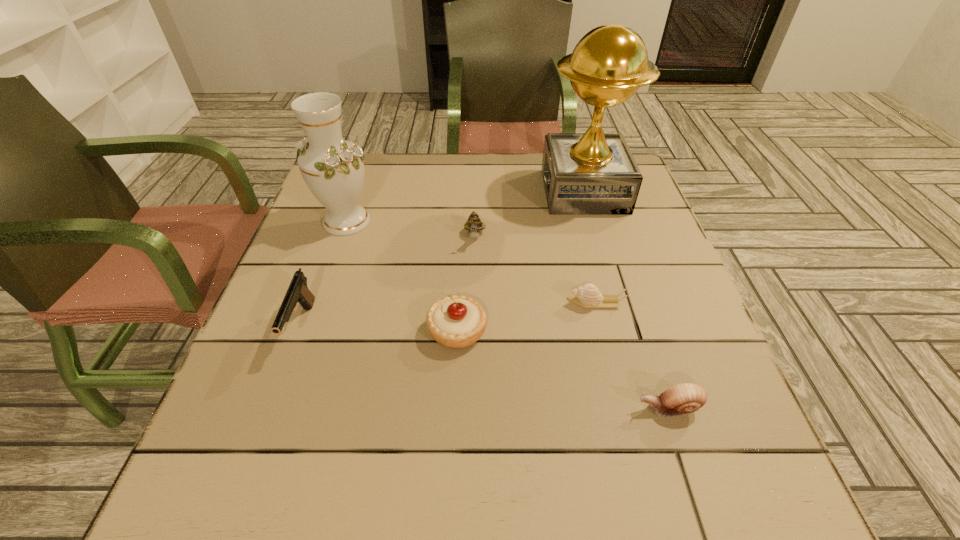
The width and height of the screenshot is (960, 540). In order to click on free space located on the shell of the shortest escargot in this screenshot , I will do `click(524, 303)`.

The image size is (960, 540). Identify the location of vacant space located on the shell of the shortest escargot. (451, 303).

You are a GUI agent. You are given a task and a screenshot of the screen. Output one action in this format:
    pyautogui.click(x=<x>, y=<y>)
    Task: Click on the vacant space situated on the shell of the shortest escargot
    
    Given the screenshot: What is the action you would take?
    pyautogui.click(x=451, y=303)

Image resolution: width=960 pixels, height=540 pixels. What are the coordinates of `object situated at the far edge` in the screenshot? It's located at (594, 173).

Locate an element on the screen. vase at the left edge is located at coordinates pos(333,169).

Locate an element on the screen. The width and height of the screenshot is (960, 540). pistol present at the left edge is located at coordinates (298, 292).

Identify the location of award that is at the right edge. (594, 173).

What are the coordinates of `object that is at the far right corner` in the screenshot? It's located at (594, 173).

At what (x,y) coordinates should I click in order to perform the action: click on vacant space at the far edge of the desktop. Please return your answer as a coordinate pair (x, y). The height and width of the screenshot is (540, 960). Looking at the image, I should click on (515, 158).

The height and width of the screenshot is (540, 960). Find the location of `free space at the near edge`. free space at the near edge is located at coordinates (517, 465).